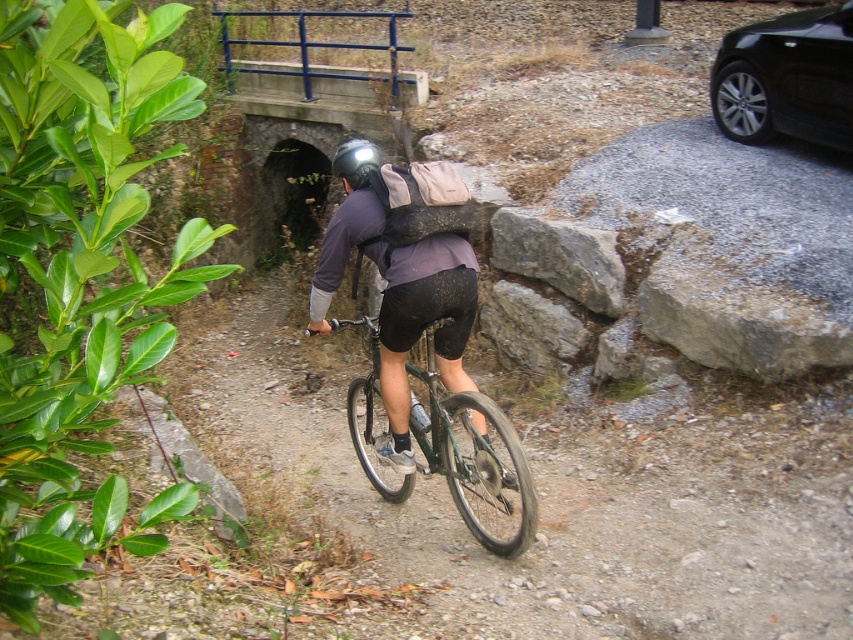
Question: Is green matte bicycle at center to the right of matte black helmet at center from the viewer's perspective?

Choices:
 (A) no
 (B) yes

Answer: (B)

Question: Which object appears farthest from the camera in this image?

Choices:
 (A) matte black helmet at center
 (B) green matte bicycle at center

Answer: (A)

Question: Does green matte bicycle at center lie behind matte black helmet at center?

Choices:
 (A) yes
 (B) no

Answer: (B)

Question: Which point is closer to the camera?

Choices:
 (A) green matte bicycle at center
 (B) matte black helmet at center

Answer: (A)

Question: Is green matte bicycle at center above matte black helmet at center?

Choices:
 (A) yes
 (B) no

Answer: (B)